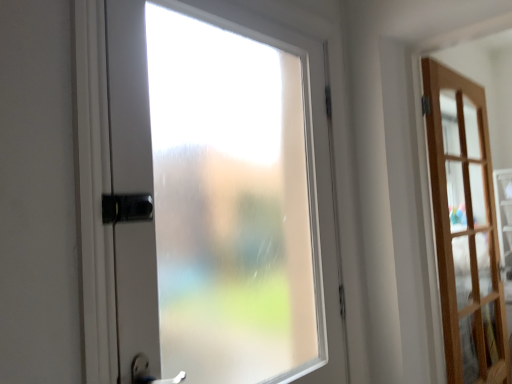
The height and width of the screenshot is (384, 512). Describe the element at coordinates (221, 196) in the screenshot. I see `frosted glass door at center, the 1th door viewed from the front` at that location.

This screenshot has height=384, width=512. I want to click on frosted glass door at center, which ranks as the 2th door in back-to-front order, so click(x=221, y=196).

Image resolution: width=512 pixels, height=384 pixels. Describe the element at coordinates (465, 228) in the screenshot. I see `light brown wooden door at right, the 2th door from the left` at that location.

Find the location of a particular element. The image size is (512, 384). light brown wooden door at right, the 1th door in the back-to-front sequence is located at coordinates (465, 228).

The image size is (512, 384). I want to click on frosted glass door at center, the 1th door viewed from the front, so click(221, 196).

Which is more to the left, frosted glass door at center, arranged as the 2th door when viewed from the right, or light brown wooden door at right, the 1th door in the back-to-front sequence?

frosted glass door at center, arranged as the 2th door when viewed from the right.

Is frosted glass door at center, marked as the 1th door in a left-to-right arrangement, further to camera compared to light brown wooden door at right, the 2th door from the left?

No, it is not.

Is point (265, 127) in front of point (479, 167)?

Yes, point (265, 127) is closer to viewer.

From the image's perspective, who appears lower, frosted glass door at center, arranged as the 2th door when viewed from the right, or light brown wooden door at right, which appears as the 1th door when viewed from the right?

From the image's view, light brown wooden door at right, which appears as the 1th door when viewed from the right, is below.

From a real-world perspective, who is located lower, frosted glass door at center, arranged as the 2th door when viewed from the right, or light brown wooden door at right, the 2th door from the left?

From a 3D spatial view, light brown wooden door at right, the 2th door from the left, is below.

Can you confirm if frosted glass door at center, which ranks as the 2th door in back-to-front order, is wider than light brown wooden door at right, which ranks as the second door in front-to-back order?

In fact, frosted glass door at center, which ranks as the 2th door in back-to-front order, might be narrower than light brown wooden door at right, which ranks as the second door in front-to-back order.

Is frosted glass door at center, arranged as the 2th door when viewed from the right, taller than light brown wooden door at right, the 1th door in the back-to-front sequence?

Incorrect, the height of frosted glass door at center, arranged as the 2th door when viewed from the right, is not larger of that of light brown wooden door at right, the 1th door in the back-to-front sequence.

Does frosted glass door at center, which ranks as the 2th door in back-to-front order, have a smaller size compared to light brown wooden door at right, which ranks as the second door in front-to-back order?

Yes.

Would you say light brown wooden door at right, which ranks as the second door in front-to-back order, is part of frosted glass door at center, marked as the 1th door in a left-to-right arrangement,'s contents?

That's incorrect, light brown wooden door at right, which ranks as the second door in front-to-back order, is not inside frosted glass door at center, marked as the 1th door in a left-to-right arrangement.

Is frosted glass door at center, marked as the 1th door in a left-to-right arrangement, positioned far away from light brown wooden door at right, which ranks as the second door in front-to-back order?

No, frosted glass door at center, marked as the 1th door in a left-to-right arrangement, is not far away from light brown wooden door at right, which ranks as the second door in front-to-back order.

Is frosted glass door at center, arranged as the 2th door when viewed from the right, turned away from light brown wooden door at right, which appears as the 1th door when viewed from the right?

No.

Can you tell me how much frosted glass door at center, which ranks as the 2th door in back-to-front order, and light brown wooden door at right, the 1th door in the back-to-front sequence, differ in facing direction?

The facing directions of frosted glass door at center, which ranks as the 2th door in back-to-front order, and light brown wooden door at right, the 1th door in the back-to-front sequence, are 0.862 degrees apart.

Where is `door in front of the light brown wooden door at right, which ranks as the second door in front-to-back order`? The height and width of the screenshot is (384, 512). door in front of the light brown wooden door at right, which ranks as the second door in front-to-back order is located at coordinates (221, 196).

Between light brown wooden door at right, which appears as the 1th door when viewed from the right, and frosted glass door at center, which ranks as the 2th door in back-to-front order, which one appears on the right side from the viewer's perspective?

light brown wooden door at right, which appears as the 1th door when viewed from the right, is more to the right.

Does light brown wooden door at right, which appears as the 1th door when viewed from the right, lie behind frosted glass door at center, marked as the 1th door in a left-to-right arrangement?

Yes.

Does point (450, 317) come closer to viewer compared to point (288, 286)?

No.

Based on the photo, from the image's perspective, is light brown wooden door at right, which appears as the 1th door when viewed from the right, above or below frosted glass door at center, the 1th door viewed from the front?

Based on their image positions, light brown wooden door at right, which appears as the 1th door when viewed from the right, is located beneath frosted glass door at center, the 1th door viewed from the front.

In the scene shown: From a real-world perspective, is light brown wooden door at right, which ranks as the second door in front-to-back order, on frosted glass door at center, the 1th door viewed from the front?

Incorrect, from a real-world perspective, light brown wooden door at right, which ranks as the second door in front-to-back order, is lower than frosted glass door at center, the 1th door viewed from the front.

Is light brown wooden door at right, the 1th door in the back-to-front sequence, wider or thinner than frosted glass door at center, the 1th door viewed from the front?

In the image, light brown wooden door at right, the 1th door in the back-to-front sequence, appears to be wider than frosted glass door at center, the 1th door viewed from the front.

Can you confirm if light brown wooden door at right, which appears as the 1th door when viewed from the right, is taller than frosted glass door at center, which ranks as the 2th door in back-to-front order?

Yes.

Considering the sizes of light brown wooden door at right, the 2th door from the left, and frosted glass door at center, arranged as the 2th door when viewed from the right, in the image, is light brown wooden door at right, the 2th door from the left, bigger or smaller than frosted glass door at center, arranged as the 2th door when viewed from the right,?

light brown wooden door at right, the 2th door from the left, is bigger than frosted glass door at center, arranged as the 2th door when viewed from the right.

Does light brown wooden door at right, which appears as the 1th door when viewed from the right, contain frosted glass door at center, arranged as the 2th door when viewed from the right?

No, frosted glass door at center, arranged as the 2th door when viewed from the right, is located outside of light brown wooden door at right, which appears as the 1th door when viewed from the right.

Would you consider light brown wooden door at right, which ranks as the second door in front-to-back order, to be distant from frosted glass door at center, marked as the 1th door in a left-to-right arrangement?

No, light brown wooden door at right, which ranks as the second door in front-to-back order, is not far away from frosted glass door at center, marked as the 1th door in a left-to-right arrangement.

Is light brown wooden door at right, which ranks as the second door in front-to-back order, facing away from frosted glass door at center, arranged as the 2th door when viewed from the right?

That's not correct — light brown wooden door at right, which ranks as the second door in front-to-back order, is not looking away from frosted glass door at center, arranged as the 2th door when viewed from the right.

Locate an element on the screen. Image resolution: width=512 pixels, height=384 pixels. door below the frosted glass door at center, the 1th door viewed from the front (from a real-world perspective) is located at coordinates (465, 228).

Find the location of a particular element. The height and width of the screenshot is (384, 512). door in front of the light brown wooden door at right, which appears as the 1th door when viewed from the right is located at coordinates (221, 196).

Where is `door that is below the frosted glass door at center, marked as the 1th door in a left-to-right arrangement (from the image's perspective)`? door that is below the frosted glass door at center, marked as the 1th door in a left-to-right arrangement (from the image's perspective) is located at coordinates (465, 228).